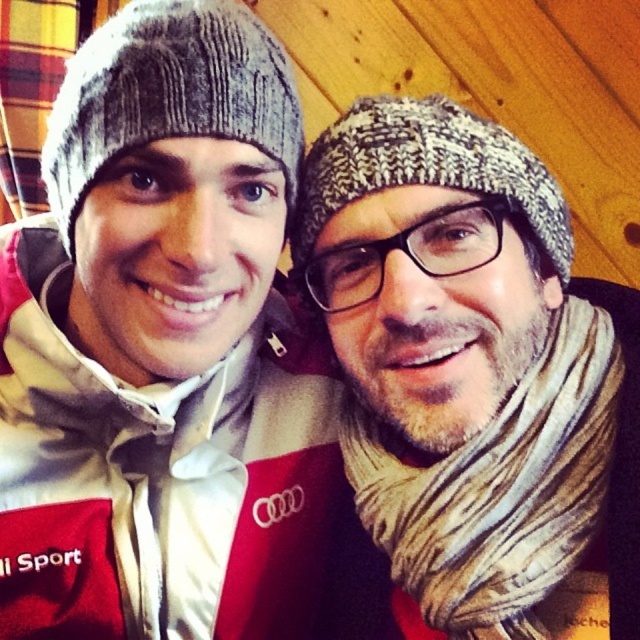
You are standing at the point marked by the coordinates point (580, 307) and want to move towards the door located at the viewer position. Can you walk straight to the door without any obstacles in your path?

The distance between point (580, 307) and the viewer is 32.54 inches, so yes, you can walk straight to the door located at the viewer position without any obstacles in your path since the path is clear.

You are planning to wear either the gray knitted beanie at upper left or the knitted gray hat at center for a winter hike. Which one would provide better head coverage based on their sizes?

The gray knitted beanie at upper left is much taller than the knitted gray hat at center, so it would provide better head coverage for a winter hike.